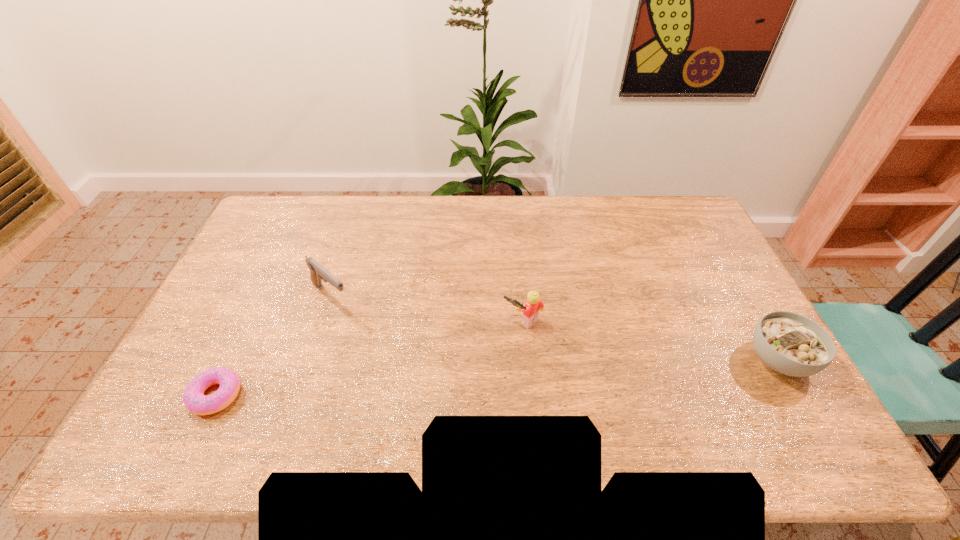
What are the coordinates of `vacant region between the shortest object and the Lego` in the screenshot? It's located at (370, 359).

Locate an element on the screen. The image size is (960, 540). blank region between the doughnut and the rightmost object is located at coordinates (497, 377).

Identify the location of vacant area between the pistol and the Lego. (427, 309).

Locate an element on the screen. The height and width of the screenshot is (540, 960). empty space that is in between the leftmost object and the Lego is located at coordinates (370, 359).

You are a GUI agent. You are given a task and a screenshot of the screen. Output one action in this format:
    pyautogui.click(x=<x>, y=<y>)
    Task: Click on the empty space between the leftmost object and the soup bowl
    The image size is (960, 540).
    Given the screenshot: What is the action you would take?
    pyautogui.click(x=497, y=377)

In order to click on free space between the second farthest object and the rightmost object in this screenshot , I will do click(x=651, y=341).

In order to click on free space between the pistol and the doughnut in this screenshot , I will do `click(274, 345)`.

At what (x,y) coordinates should I click in order to perform the action: click on object that ranks as the second closest to the pistol. Please return your answer as a coordinate pair (x, y). Looking at the image, I should click on (531, 309).

Point out which object is positioned as the third nearest to the soup bowl. Please provide its 2D coordinates. Your answer should be formatted as a tuple, i.e. [(x, y)], where the tuple contains the x and y coordinates of a point satisfying the conditions above.

[(194, 399)]

Locate an element on the screen. The image size is (960, 540). vacant position in the image that satisfies the following two spatial constraints: 1. on the back side of the leftmost object; 2. on the right side of the farthest object is located at coordinates (263, 295).